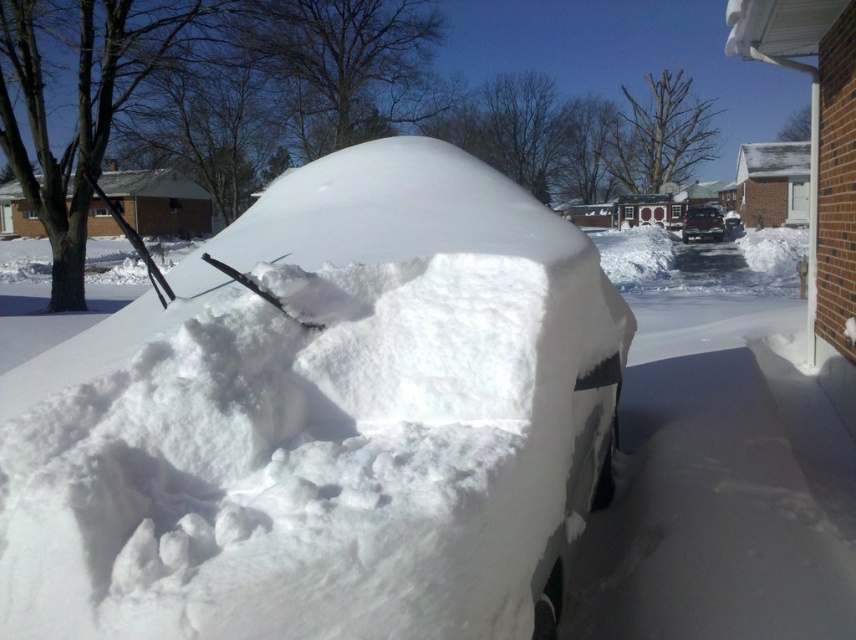
Which is behind, point (372, 326) or point (699, 236)?

The point (699, 236) is more distant.

Describe the element at coordinates (324, 420) in the screenshot. This screenshot has width=856, height=640. I see `white fluffy snow at center` at that location.

Is point (494, 330) farther from viewer compared to point (698, 220)?

No, it is not.

Locate an element on the screen. The height and width of the screenshot is (640, 856). white fluffy snow at center is located at coordinates (324, 420).